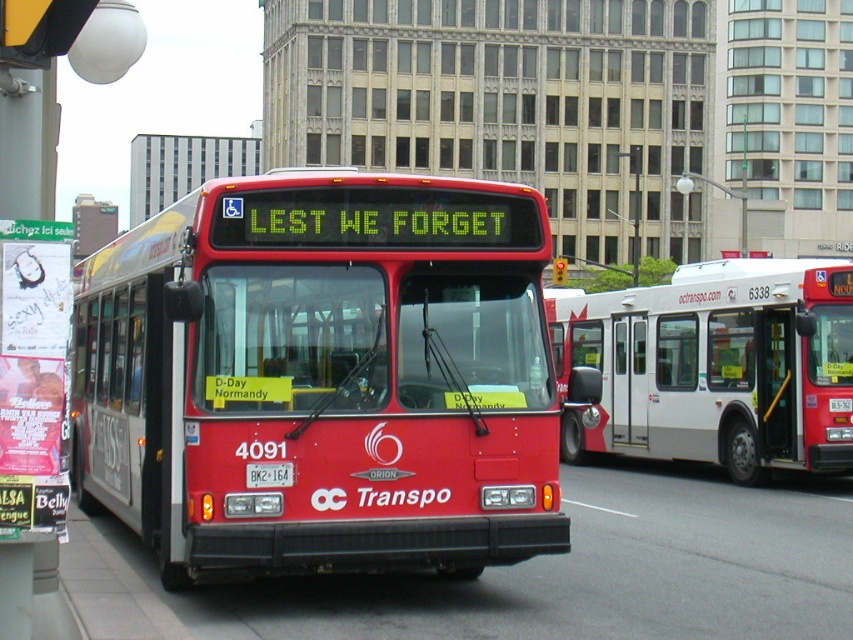
Question: Where is matte red bus at center located in relation to white plastic license plate at center in the image?

Choices:
 (A) left
 (B) right

Answer: (A)

Question: Based on their relative distances, which object is nearer to the white matte bus at center?

Choices:
 (A) white plastic license plate at center
 (B) matte red bus at center

Answer: (A)

Question: Can you confirm if white matte bus at center is wider than white plastic license plate at center?

Choices:
 (A) yes
 (B) no

Answer: (A)

Question: Does white matte bus at center appear on the right side of white plastic license plate at center?

Choices:
 (A) no
 (B) yes

Answer: (B)

Question: Which is farther from the white matte bus at center?

Choices:
 (A) matte red bus at center
 (B) white plastic license plate at center

Answer: (A)

Question: Among these objects, which one is nearest to the camera?

Choices:
 (A) matte red bus at center
 (B) white plastic license plate at center
 (C) white matte bus at center

Answer: (A)